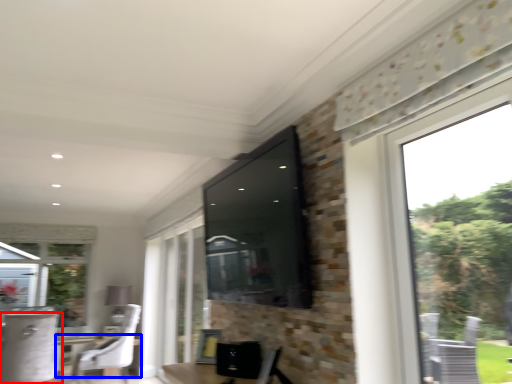
Question: Among these objects, which one is farthest to the camera, chair (highlighted by a red box) or round table (highlighted by a blue box)?

Choices:
 (A) chair
 (B) round table

Answer: (B)